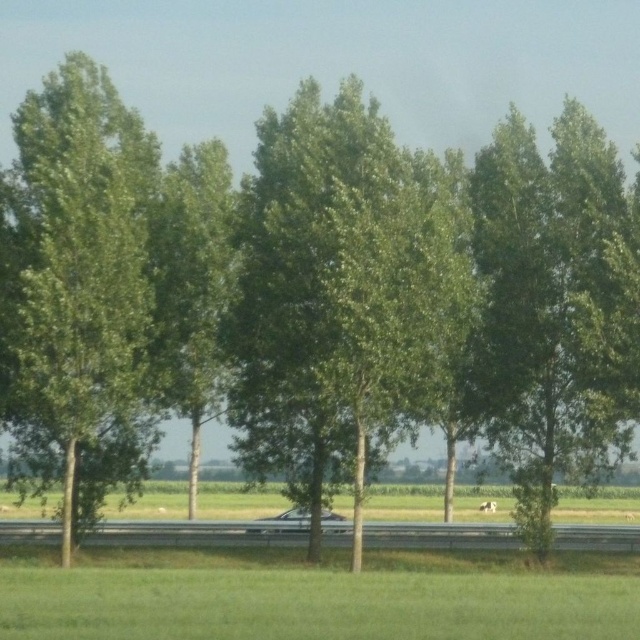
Which is more to the right, green grass at lower center or green leafy tree at left?

green grass at lower center is more to the right.

Is the position of green grass at lower center less distant than that of green leafy tree at left?

Yes, it is in front of green leafy tree at left.

Is point (627, 608) closer to viewer compared to point (88, 275)?

Yes, it is in front of point (88, 275).

You are a GUI agent. You are given a task and a screenshot of the screen. Output one action in this format:
    pyautogui.click(x=<x>, y=<y>)
    Task: Click on the green grass at lower center
    The height and width of the screenshot is (640, 640).
    Given the screenshot: What is the action you would take?
    pyautogui.click(x=314, y=595)

Is green leafy tree at center bigger than green leafy tree at left?

No.

Which is in front, point (296, 131) or point (122, 403)?

Point (122, 403) is in front.

In order to click on green leafy tree at center in this screenshot , I will do `click(339, 296)`.

Is green leafy tree at center positioned at the back of green grass at lower center?

Yes.

Is point (326, 296) in front of point (464, 627)?

No, it is behind (464, 627).

Describe the element at coordinates (339, 296) in the screenshot. I see `green leafy tree at center` at that location.

Where is `green leafy tree at center`? green leafy tree at center is located at coordinates (339, 296).